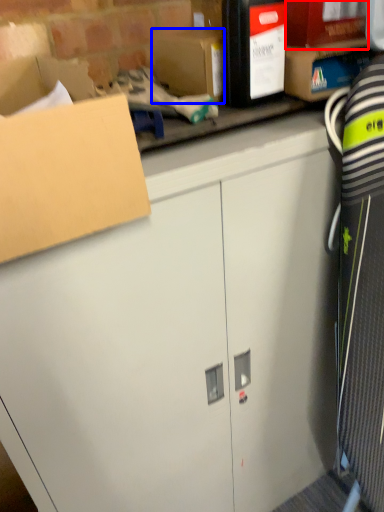
Question: Among these objects, which one is farthest to the camera, storage box (highlighted by a red box) or storage box (highlighted by a blue box)?

Choices:
 (A) storage box
 (B) storage box

Answer: (B)